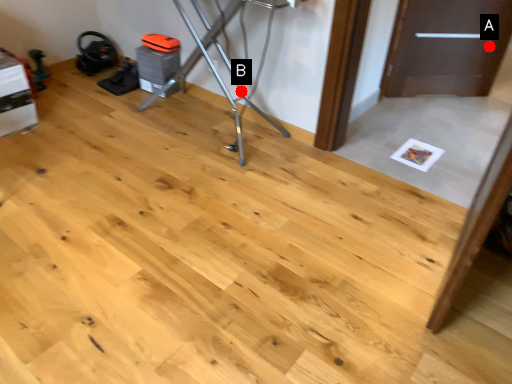
Question: Two points are circled on the image, labeled by A and B beside each circle. Which of the following is the farthest from the observer?

Choices:
 (A) A is further
 (B) B is further

Answer: (A)